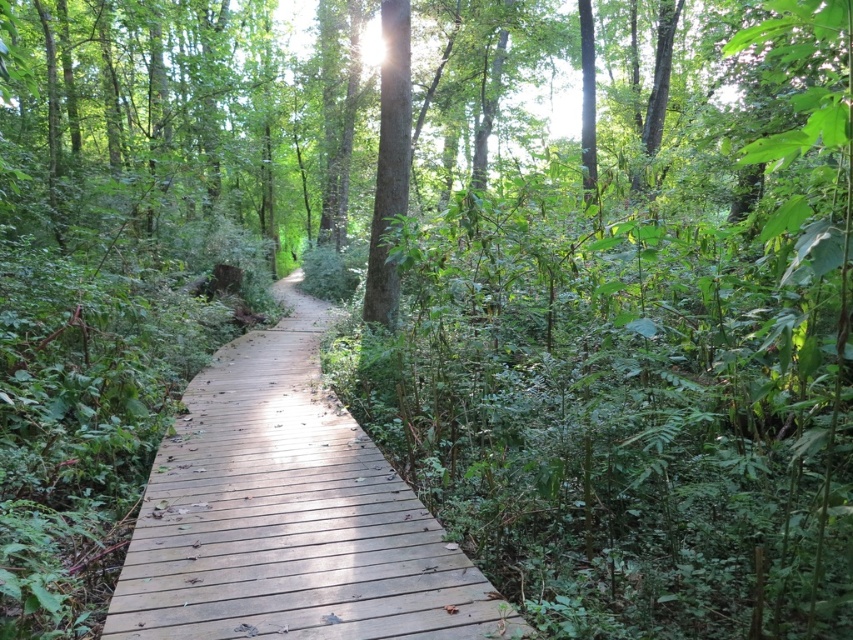
Question: Is wooden at center in front of green matte tree at center?

Choices:
 (A) no
 (B) yes

Answer: (B)

Question: Is wooden at center positioned before green matte tree at center?

Choices:
 (A) no
 (B) yes

Answer: (B)

Question: Can you confirm if wooden at center is bigger than green matte tree at center?

Choices:
 (A) no
 (B) yes

Answer: (A)

Question: Which point is closer to the camera?

Choices:
 (A) green matte tree at center
 (B) wooden at center

Answer: (B)

Question: Which object is closer to the camera taking this photo?

Choices:
 (A) wooden at center
 (B) green matte tree at center

Answer: (A)

Question: Among these points, which one is nearest to the camera?

Choices:
 (A) (202, 572)
 (B) (387, 163)

Answer: (A)